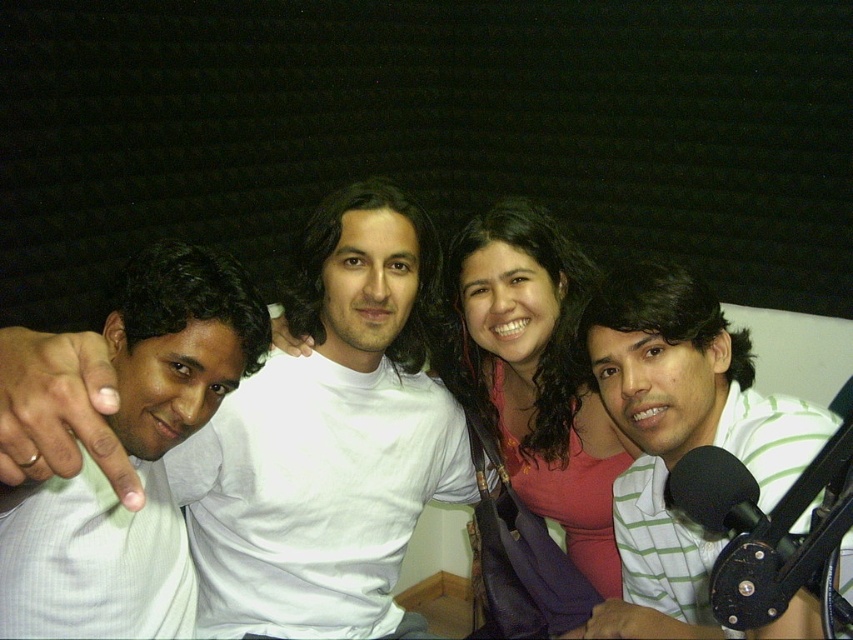
Is the position of white shirt at left less distant than that of pink fabric at center?

Yes, it is.

Does white shirt at left have a greater height compared to pink fabric at center?

Incorrect, white shirt at left's height is not larger of pink fabric at center's.

Where is `white shirt at left`? white shirt at left is located at coordinates (132, 458).

The height and width of the screenshot is (640, 853). What are the coordinates of `white shirt at left` in the screenshot? It's located at (132, 458).

Does white striped shirt at center appear on the left side of pink fabric at center?

Incorrect, white striped shirt at center is not on the left side of pink fabric at center.

Is point (640, 420) behind point (505, 404)?

No, it is in front of (505, 404).

The height and width of the screenshot is (640, 853). What are the coordinates of `white striped shirt at center` in the screenshot? It's located at (680, 436).

Is white matte t-shirt at center shorter than pink fabric at center?

No, white matte t-shirt at center is not shorter than pink fabric at center.

Does white matte t-shirt at center lie in front of pink fabric at center?

Yes, it is.

You are a GUI agent. You are given a task and a screenshot of the screen. Output one action in this format:
    pyautogui.click(x=<x>, y=<y>)
    Task: Click on the white matte t-shirt at center
    The height and width of the screenshot is (640, 853).
    Given the screenshot: What is the action you would take?
    pyautogui.click(x=329, y=438)